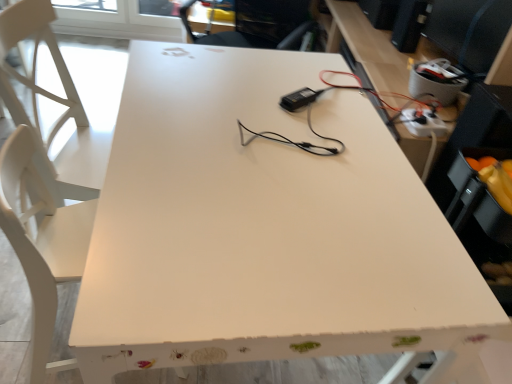
Question: Which is correct: white glossy computer desk at right is inside white plastic extension cord at upper right, or outside of it?

Choices:
 (A) inside
 (B) outside

Answer: (B)

Question: Is point (386, 94) positioned closer to the camera than point (438, 125)?

Choices:
 (A) closer
 (B) farther

Answer: (B)

Question: Looking at the image, does white glossy computer desk at right seem bigger or smaller compared to white plastic extension cord at upper right?

Choices:
 (A) small
 (B) big

Answer: (B)

Question: Based on their sizes in the image, would you say white plastic extension cord at upper right is bigger or smaller than white glossy computer desk at right?

Choices:
 (A) big
 (B) small

Answer: (B)

Question: Is white plastic extension cord at upper right situated inside white glossy computer desk at right or outside?

Choices:
 (A) outside
 (B) inside

Answer: (B)

Question: Considering the positions of white plastic extension cord at upper right and white glossy computer desk at right in the image, is white plastic extension cord at upper right taller or shorter than white glossy computer desk at right?

Choices:
 (A) short
 (B) tall

Answer: (A)

Question: From a real-world perspective, relative to white glossy computer desk at right, is white plastic extension cord at upper right vertically above or below?

Choices:
 (A) below
 (B) above

Answer: (B)